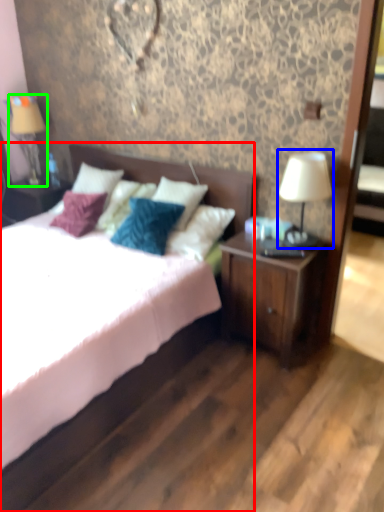
Question: Considering the real-world distances, which object is closest to bed (highlighted by a red box)? table lamp (highlighted by a blue box) or table lamp (highlighted by a green box).

Choices:
 (A) table lamp
 (B) table lamp

Answer: (A)